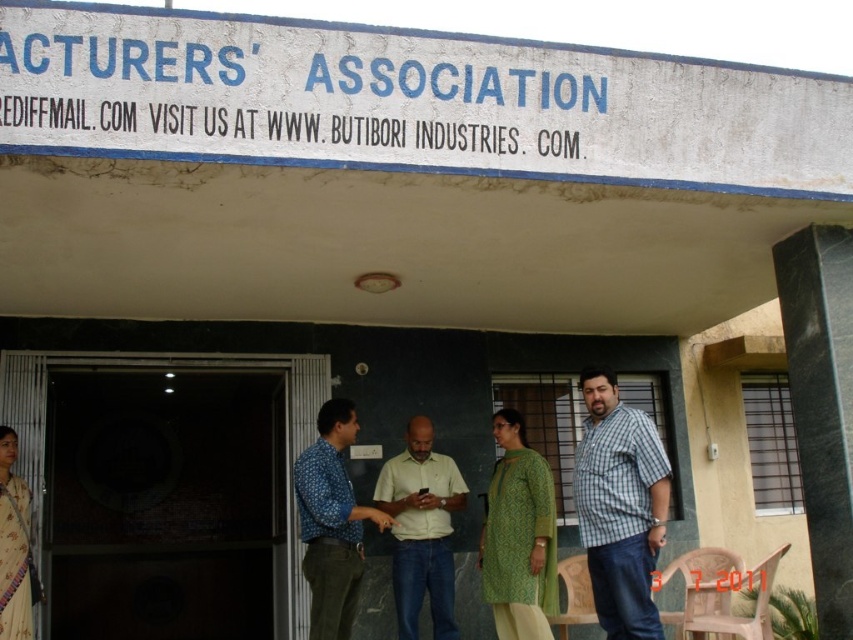
Question: Where is checkered fabric shirt at center located in relation to beige silk saree at left in the image?

Choices:
 (A) above
 (B) below

Answer: (A)

Question: Which object appears closest to the camera in this image?

Choices:
 (A) green textured kurta at center
 (B) blue patterned shirt at center

Answer: (B)

Question: Can you confirm if white concrete sign at upper center is positioned below blue patterned shirt at center?

Choices:
 (A) yes
 (B) no

Answer: (B)

Question: Which point is farther to the camera?

Choices:
 (A) checkered fabric shirt at center
 (B) light beige cotton shirt at center
 (C) beige silk saree at left
 (D) green textured kurta at center

Answer: (B)

Question: In this image, where is white concrete sign at upper center located relative to light beige cotton shirt at center?

Choices:
 (A) right
 (B) left

Answer: (A)

Question: Which point is closer to the camera taking this photo?

Choices:
 (A) (347, 632)
 (B) (403, 536)
 (C) (601, 390)

Answer: (C)